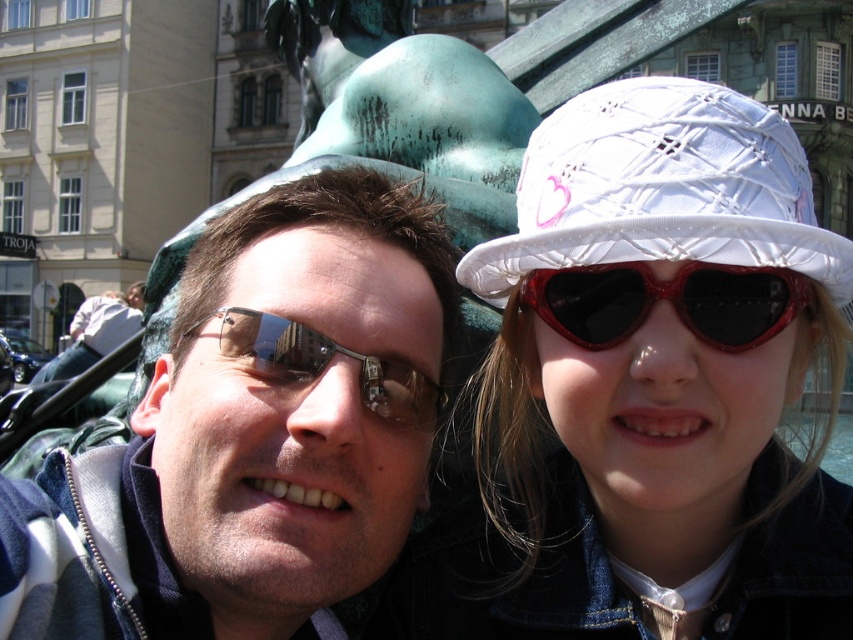
You are a photographer trying to capture a clear photo of both the metallic sunglasses at center and the metallic reflective sunglasses at center. Given that your camera has a depth of field that can focus on objects within a 5 feet range, will both pairs of sunglasses be in focus?

The distance between the metallic sunglasses at center and the metallic reflective sunglasses at center is 5.09 feet, which exceeds the camera sensor range of 5 feet. Therefore, both sunglasses cannot be in focus simultaneously.